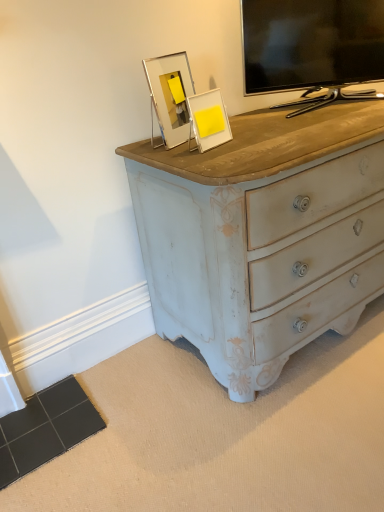
Question: Is clear acrylic frame at upper center, placed as the 2th picture frame when sorted from right to left, spatially inside yellow matte picture frame at upper center, which is the 2th picture frame in left-to-right order, or outside of it?

Choices:
 (A) outside
 (B) inside

Answer: (A)

Question: Based on their positions, is clear acrylic frame at upper center, placed as the 2th picture frame when sorted from right to left, located to the left or right of yellow matte picture frame at upper center, which is the 2th picture frame in left-to-right order?

Choices:
 (A) right
 (B) left

Answer: (B)

Question: Considering the real-world distances, which object is farthest from the clear acrylic frame at upper center, positioned as the 1th picture frame in left-to-right order?

Choices:
 (A) black glossy tv at upper right
 (B) yellow matte picture frame at upper center, which is the 2th picture frame in left-to-right order

Answer: (A)

Question: Considering the real-world distances, which object is farthest from the black glossy tv at upper right?

Choices:
 (A) clear acrylic frame at upper center, positioned as the 1th picture frame in left-to-right order
 (B) yellow matte picture frame at upper center, which is the 2th picture frame in left-to-right order

Answer: (A)